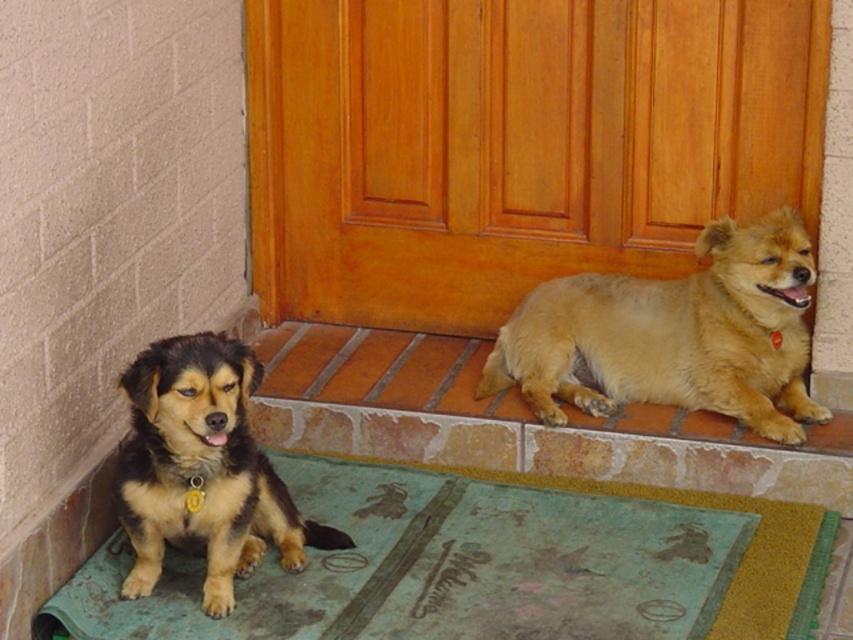
Question: Based on their relative distances, which object is nearer to the brown fur dog at left?

Choices:
 (A) light brown fur at lower right
 (B) green fabric doormat at lower left

Answer: (B)

Question: Based on their relative distances, which object is nearer to the wooden at center?

Choices:
 (A) light brown fur at lower right
 (B) green fabric doormat at lower left

Answer: (A)

Question: Can you confirm if wooden at center is bigger than brown fur dog at left?

Choices:
 (A) no
 (B) yes

Answer: (B)

Question: Which object is the farthest from the light brown fur at lower right?

Choices:
 (A) wooden at center
 (B) brown fur dog at left
 (C) green fabric doormat at lower left

Answer: (B)

Question: Is wooden at center smaller than light brown fur at lower right?

Choices:
 (A) no
 (B) yes

Answer: (A)

Question: Can you confirm if wooden at center is wider than light brown fur at lower right?

Choices:
 (A) yes
 (B) no

Answer: (A)